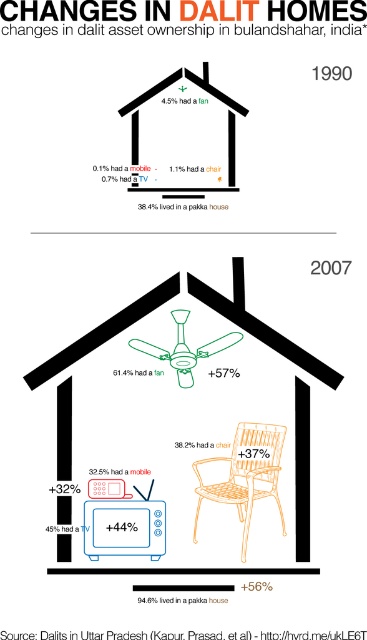
Question: Does blue plastic tv at lower left appear over orange woven chair at center?

Choices:
 (A) yes
 (B) no

Answer: (A)

Question: Which of the following is the closest to the observer?

Choices:
 (A) (248, 490)
 (B) (136, 157)
 (C) (219, 310)

Answer: (A)

Question: Which point is farther to the camera?

Choices:
 (A) blue plastic tv at lower left
 (B) matte black tv at lower left
 (C) orange woven chair at center

Answer: (B)

Question: Is blue plastic tv at lower left below matte black tv at lower left?

Choices:
 (A) yes
 (B) no

Answer: (A)

Question: Considering the real-world distances, which object is farthest from the orange woven chair at center?

Choices:
 (A) matte black tv at lower left
 (B) blue plastic tv at lower left

Answer: (A)

Question: Is blue plastic tv at lower left to the left of matte black tv at lower left from the viewer's perspective?

Choices:
 (A) no
 (B) yes

Answer: (B)